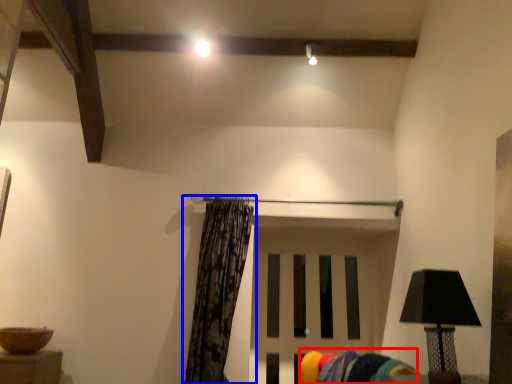
Question: Which object appears closest to the camera in this image, swivel chair (highlighted by a red box) or curtain (highlighted by a blue box)?

Choices:
 (A) swivel chair
 (B) curtain

Answer: (A)